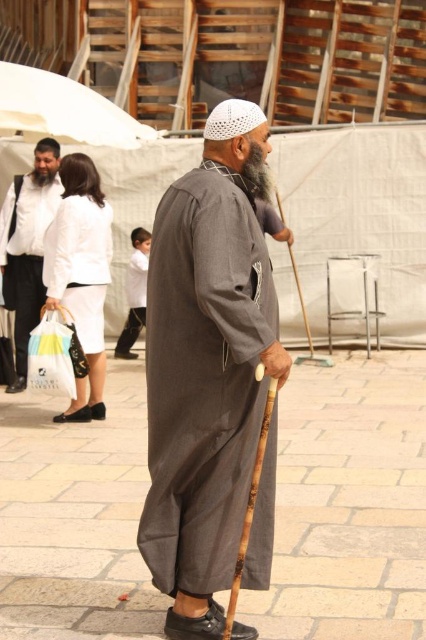
Question: Estimate the real-world distances between objects in this image. Which object is farther from the white cotton dress at lower left?

Choices:
 (A) brick pavement at center
 (B) white matte jacket at upper left

Answer: (A)

Question: Which object is closer to the camera taking this photo?

Choices:
 (A) white matte robe at center
 (B) white cotton dress at lower left
 (C) gray fuzzy beard at center

Answer: (C)

Question: Which is nearer to the gray fuzzy beard at center?

Choices:
 (A) white cotton dress at lower left
 (B) white plastic bag at lower left
 (C) brick pavement at center

Answer: (C)

Question: Is white plastic bag at lower left above gray fuzzy beard at center?

Choices:
 (A) no
 (B) yes

Answer: (A)

Question: From the image, what is the correct spatial relationship of brick pavement at center in relation to gray fuzzy beard at center?

Choices:
 (A) below
 (B) above

Answer: (A)

Question: Does gray fabric abaya at center appear over white cotton dress at lower left?

Choices:
 (A) yes
 (B) no

Answer: (B)